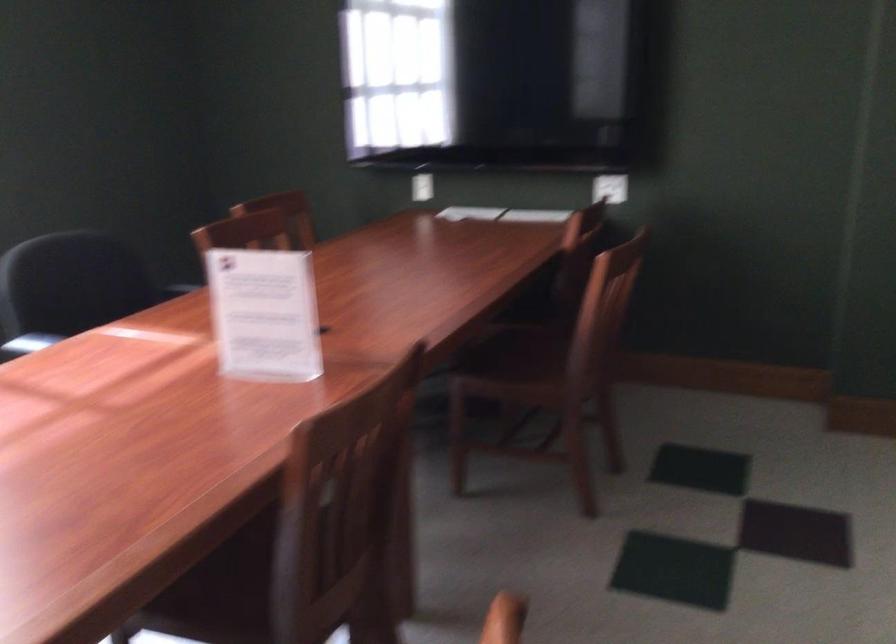
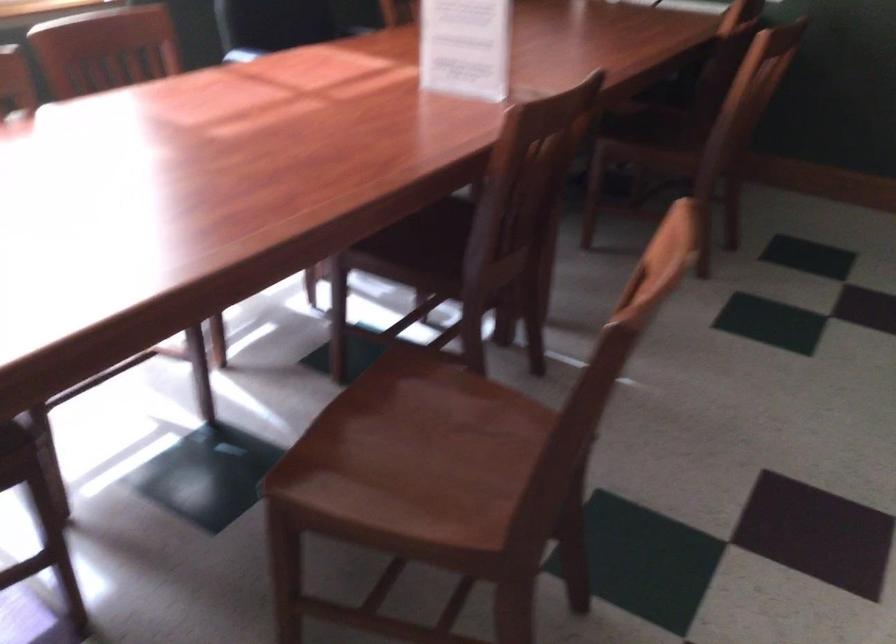
The images are taken continuously from a first-person perspective. In which direction are you moving?

The cameraman walked toward left, backward.